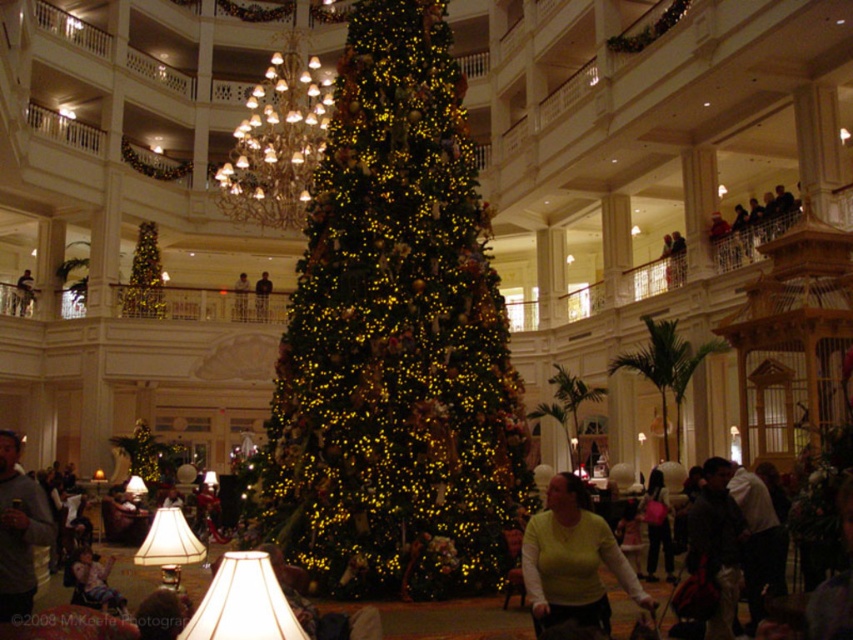
Is light green sweater at center further to the viewer compared to dark gray jacket at lower right?

No.

Who is more forward, (566,563) or (732,500)?

Point (566,563) is in front.

Is point (579, 520) behind point (724, 596)?

No, (579, 520) is closer to viewer.

At what (x,y) coordinates should I click in order to perform the action: click on light green sweater at center. Please return your answer as a coordinate pair (x, y). Looking at the image, I should click on coord(572,561).

How distant is light green sweater at center from matte black jacket at center?

The distance of light green sweater at center from matte black jacket at center is 240.68 feet.

Which is below, light green sweater at center or matte black jacket at center?

light green sweater at center is below.

Locate an element on the screen. Image resolution: width=853 pixels, height=640 pixels. light green sweater at center is located at coordinates (572, 561).

Who is positioned more to the left, gray sweater at center or light brown wooden chair at center?

From the viewer's perspective, light brown wooden chair at center appears more on the left side.

What are the coordinates of `gray sweater at center` in the screenshot? It's located at (19, 531).